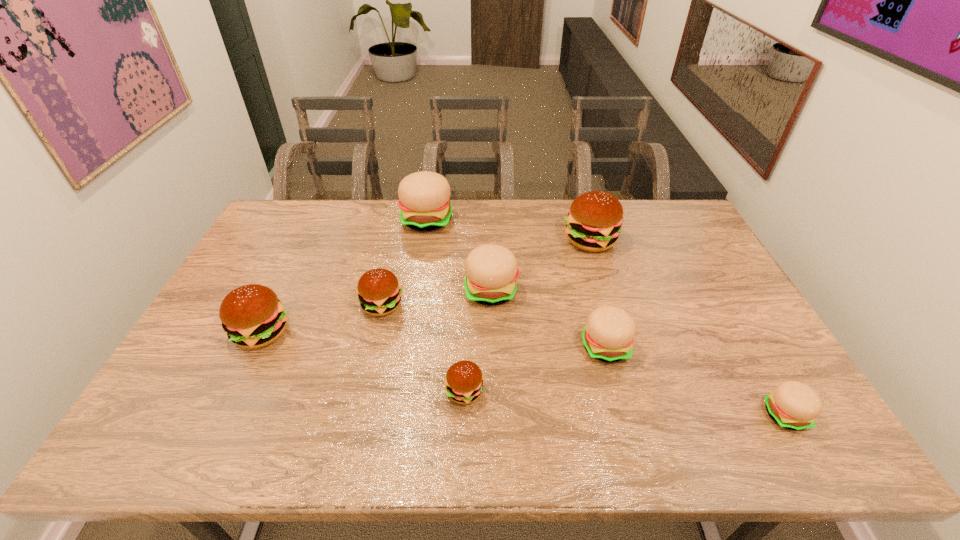
Locate an element on the screen. This screenshot has height=540, width=960. free space between the third biggest brown hamburger and the second nearest beige hamburger is located at coordinates (493, 326).

This screenshot has height=540, width=960. Find the location of `vacant area between the third biggest beige hamburger and the rightmost brown hamburger`. vacant area between the third biggest beige hamburger and the rightmost brown hamburger is located at coordinates (597, 294).

Select which object is the fourth closest to the third beige hamburger from left to right. Please provide its 2D coordinates. Your answer should be formatted as a tuple, i.e. [(x, y)], where the tuple contains the x and y coordinates of a point satisfying the conditions above.

[(594, 221)]

Choose which object is the second nearest neighbor to the biggest beige hamburger. Please provide its 2D coordinates. Your answer should be formatted as a tuple, i.e. [(x, y)], where the tuple contains the x and y coordinates of a point satisfying the conditions above.

[(379, 292)]

Find the location of a particular element. The image size is (960, 540). hamburger that is the third closest to the farthest beige hamburger is located at coordinates (594, 221).

Identify the location of hamburger that stands as the seventh closest to the third smallest brown hamburger. (793, 405).

In order to click on the closest brown hamburger relative to the third biggest brown hamburger in this screenshot , I will do `click(252, 315)`.

This screenshot has width=960, height=540. Find the location of `the closest brown hamburger to the biggest brown hamburger`. the closest brown hamburger to the biggest brown hamburger is located at coordinates (379, 292).

Identify which beige hamburger is the closest to the second smallest brown hamburger. Please provide its 2D coordinates. Your answer should be formatted as a tuple, i.e. [(x, y)], where the tuple contains the x and y coordinates of a point satisfying the conditions above.

[(491, 270)]

Identify which beige hamburger is located as the second nearest to the rightmost beige hamburger. Please provide its 2D coordinates. Your answer should be formatted as a tuple, i.e. [(x, y)], where the tuple contains the x and y coordinates of a point satisfying the conditions above.

[(491, 270)]